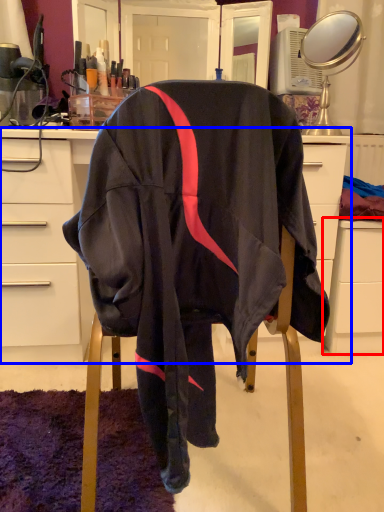
Question: Which object is closer to the camera taking this photo, file cabinet (highlighted by a red box) or desk (highlighted by a blue box)?

Choices:
 (A) file cabinet
 (B) desk

Answer: (B)